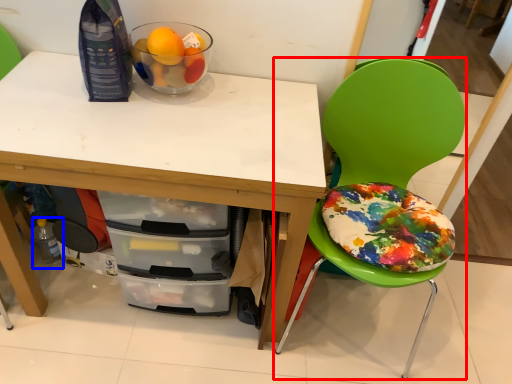
Question: Among these objects, which one is nearest to the camera, chair (highlighted by a red box) or bottle (highlighted by a blue box)?

Choices:
 (A) chair
 (B) bottle

Answer: (A)